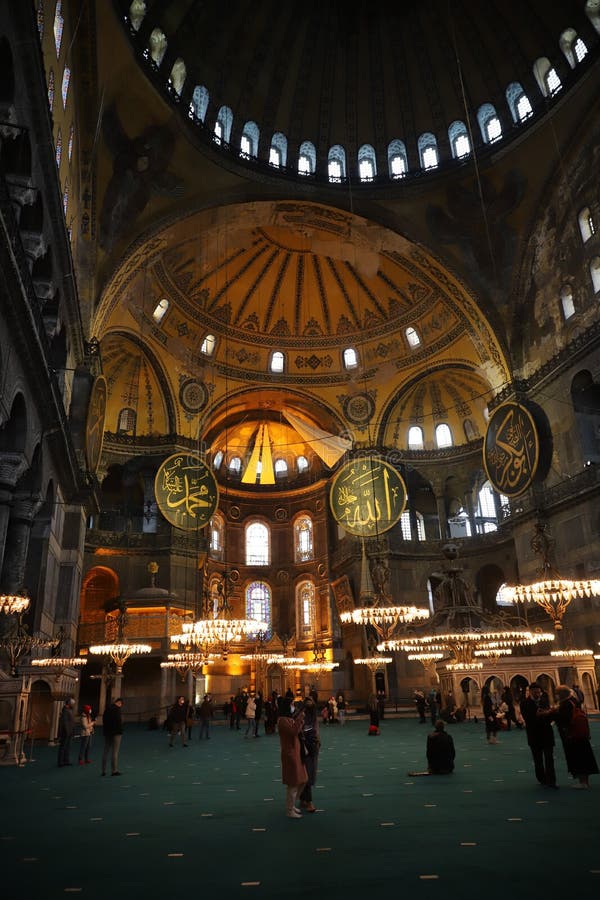
You are a GUI agent. You are given a task and a screenshot of the screen. Output one action in this format:
    pyautogui.click(x=<x>, y=<y>)
    Task: Click on the inner walls of building
    
    Given the screenshot: What is the action you would take?
    pyautogui.click(x=573, y=527), pyautogui.click(x=445, y=480), pyautogui.click(x=178, y=552)